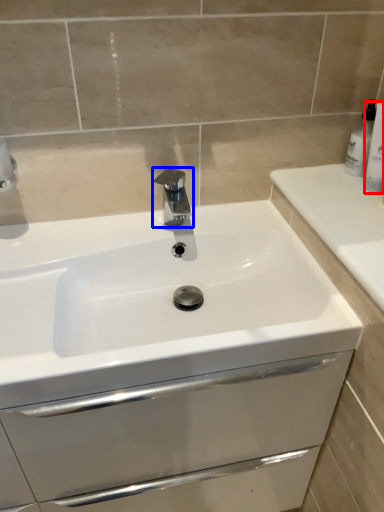
Question: Which point is closer to the camera, toiletry (highlighted by a red box) or tap (highlighted by a blue box)?

Choices:
 (A) toiletry
 (B) tap

Answer: (A)